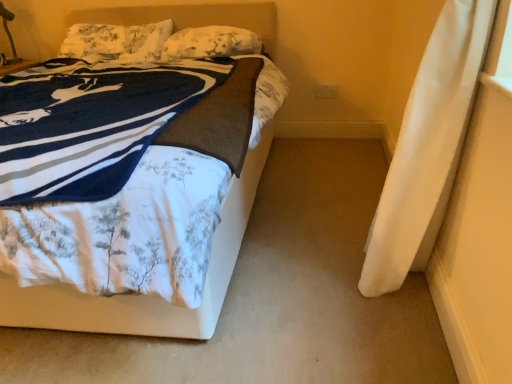
Question: Is fluffy white pillow at upper center, placed as the 1th pillow when sorted from right to left, surrounded by white floral fabric bed at upper left?

Choices:
 (A) no
 (B) yes

Answer: (B)

Question: Is white floral fabric bed at upper left thinner than fluffy white pillow at upper center, arranged as the 2th pillow when viewed from the left?

Choices:
 (A) yes
 (B) no

Answer: (B)

Question: Does white floral fabric bed at upper left have a greater height compared to fluffy white pillow at upper center, placed as the 1th pillow when sorted from right to left?

Choices:
 (A) yes
 (B) no

Answer: (A)

Question: From a real-world perspective, is white floral fabric bed at upper left below fluffy white pillow at upper center, arranged as the 2th pillow when viewed from the left?

Choices:
 (A) yes
 (B) no

Answer: (A)

Question: Does white floral fabric bed at upper left appear on the left side of fluffy white pillow at upper center, placed as the 1th pillow when sorted from right to left?

Choices:
 (A) no
 (B) yes

Answer: (B)

Question: Is white floral fabric bed at upper left placed right next to fluffy white pillow at upper center, arranged as the 2th pillow when viewed from the left?

Choices:
 (A) no
 (B) yes

Answer: (A)

Question: Does fluffy white pillow at upper center, placed as the 1th pillow when sorted from right to left, lie in front of white floral fabric bed at upper left?

Choices:
 (A) yes
 (B) no

Answer: (B)

Question: Considering the relative positions of fluffy white pillow at upper center, arranged as the 2th pillow when viewed from the left, and white floral fabric bed at upper left in the image provided, is fluffy white pillow at upper center, arranged as the 2th pillow when viewed from the left, to the right of white floral fabric bed at upper left from the viewer's perspective?

Choices:
 (A) no
 (B) yes

Answer: (B)

Question: Is fluffy white pillow at upper center, placed as the 1th pillow when sorted from right to left, wider than white floral fabric bed at upper left?

Choices:
 (A) yes
 (B) no

Answer: (B)

Question: Does fluffy white pillow at upper center, placed as the 1th pillow when sorted from right to left, come behind white floral fabric bed at upper left?

Choices:
 (A) yes
 (B) no

Answer: (A)

Question: From the image's perspective, is fluffy white pillow at upper center, arranged as the 2th pillow when viewed from the left, under white floral fabric bed at upper left?

Choices:
 (A) yes
 (B) no

Answer: (B)

Question: Is fluffy white pillow at upper center, arranged as the 2th pillow when viewed from the left, smaller than white floral fabric bed at upper left?

Choices:
 (A) yes
 (B) no

Answer: (A)

Question: Is fluffy white pillow at upper center, placed as the 1th pillow when sorted from right to left, thinner than metallic gold table lamp at upper left?

Choices:
 (A) no
 (B) yes

Answer: (A)